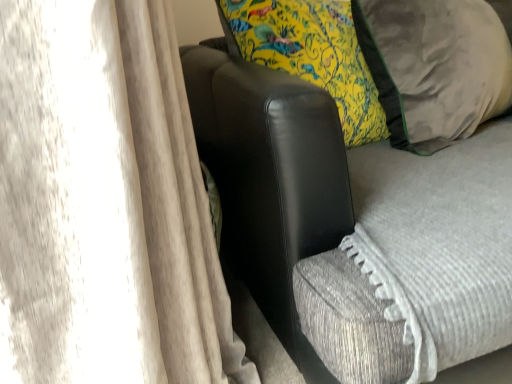
Question: Does suede-like beige pillow at right lie behind black leather armchair at center?

Choices:
 (A) yes
 (B) no

Answer: (A)

Question: Is suede-like beige pillow at right taller than black leather armchair at center?

Choices:
 (A) yes
 (B) no

Answer: (B)

Question: Does suede-like beige pillow at right come in front of black leather armchair at center?

Choices:
 (A) yes
 (B) no

Answer: (B)

Question: Is black leather armchair at center located within suede-like beige pillow at right?

Choices:
 (A) yes
 (B) no

Answer: (B)

Question: Considering the relative sizes of suede-like beige pillow at right and black leather armchair at center in the image provided, is suede-like beige pillow at right shorter than black leather armchair at center?

Choices:
 (A) yes
 (B) no

Answer: (A)

Question: From a real-world perspective, is suede-like beige pillow at right on black leather armchair at center?

Choices:
 (A) no
 (B) yes

Answer: (B)

Question: From the image's perspective, is black leather armchair at center located above suede-like beige pillow at right?

Choices:
 (A) yes
 (B) no

Answer: (B)

Question: Can you confirm if black leather armchair at center is positioned to the right of suede-like beige pillow at right?

Choices:
 (A) no
 (B) yes

Answer: (A)

Question: From the image's perspective, is black leather armchair at center beneath suede-like beige pillow at right?

Choices:
 (A) yes
 (B) no

Answer: (A)

Question: From a real-world perspective, is black leather armchair at center below suede-like beige pillow at right?

Choices:
 (A) no
 (B) yes

Answer: (B)

Question: Is black leather armchair at center located outside suede-like beige pillow at right?

Choices:
 (A) no
 (B) yes

Answer: (B)

Question: Is black leather armchair at center bigger than suede-like beige pillow at right?

Choices:
 (A) no
 (B) yes

Answer: (B)

Question: From their relative heights in the image, would you say black leather armchair at center is taller or shorter than suede-like beige pillow at right?

Choices:
 (A) short
 (B) tall

Answer: (B)